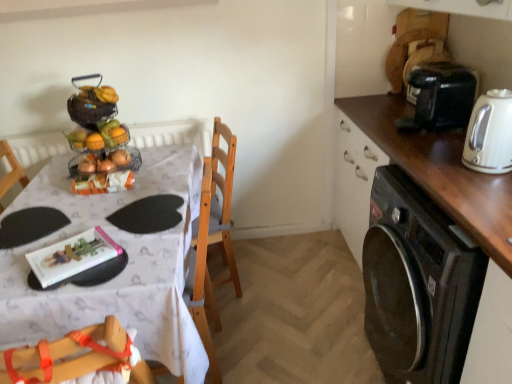
Question: Is the depth of shiny metallic fruit basket at upper left less than that of black matte paper plate at lower left?

Choices:
 (A) no
 (B) yes

Answer: (A)

Question: Considering the relative sizes of shiny metallic fruit basket at upper left and black matte paper plate at lower left in the image provided, is shiny metallic fruit basket at upper left shorter than black matte paper plate at lower left?

Choices:
 (A) yes
 (B) no

Answer: (B)

Question: From a real-world perspective, is shiny metallic fruit basket at upper left on top of black matte paper plate at lower left?

Choices:
 (A) no
 (B) yes

Answer: (B)

Question: Does shiny metallic fruit basket at upper left turn towards black matte paper plate at lower left?

Choices:
 (A) yes
 (B) no

Answer: (B)

Question: Can you confirm if shiny metallic fruit basket at upper left is smaller than black matte paper plate at lower left?

Choices:
 (A) no
 (B) yes

Answer: (A)

Question: Would you say white paper at left is inside or outside white glossy table at upper left?

Choices:
 (A) outside
 (B) inside

Answer: (B)

Question: From a real-world perspective, is white paper at left physically located above or below white glossy table at upper left?

Choices:
 (A) above
 (B) below

Answer: (A)

Question: Considering their positions, is white paper at left located in front of or behind white glossy table at upper left?

Choices:
 (A) behind
 (B) front

Answer: (A)

Question: In the image, is white paper at left on the left side or the right side of white glossy table at upper left?

Choices:
 (A) right
 (B) left

Answer: (A)

Question: In terms of size, does black matte paper plate at lower left appear bigger or smaller than white paper at left?

Choices:
 (A) small
 (B) big

Answer: (B)

Question: Considering the positions of black matte paper plate at lower left and white paper at left in the image, is black matte paper plate at lower left taller or shorter than white paper at left?

Choices:
 (A) short
 (B) tall

Answer: (A)

Question: From a real-world perspective, relative to white paper at left, is black matte paper plate at lower left vertically above or below?

Choices:
 (A) above
 (B) below

Answer: (B)

Question: Is point (4, 225) closer or farther from the camera than point (64, 248)?

Choices:
 (A) farther
 (B) closer

Answer: (A)

Question: From a real-world perspective, is wire mesh basket at center above or below metallic wire fruit stand at upper left?

Choices:
 (A) below
 (B) above

Answer: (A)

Question: Based on their sizes in the image, would you say wire mesh basket at center is bigger or smaller than metallic wire fruit stand at upper left?

Choices:
 (A) big
 (B) small

Answer: (B)